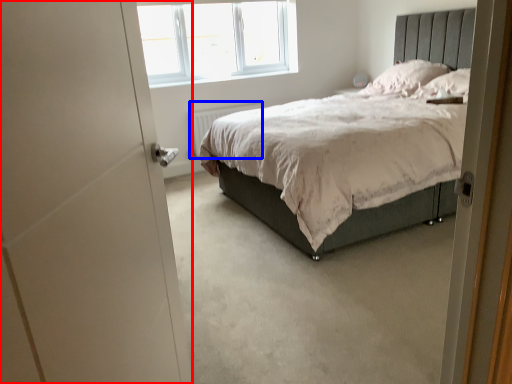
Question: Which point is further to the camera, screen door (highlighted by a red box) or radiator (highlighted by a blue box)?

Choices:
 (A) screen door
 (B) radiator

Answer: (B)